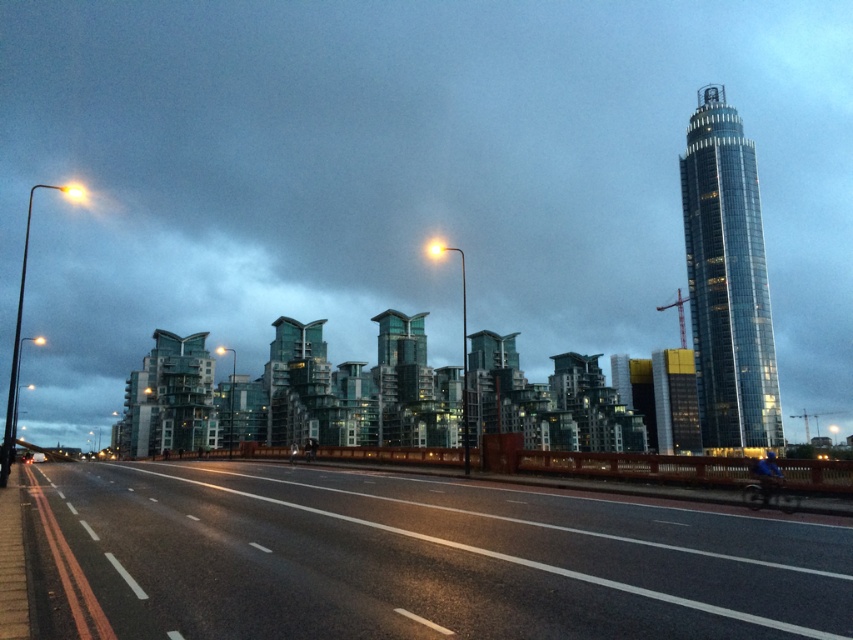
Does black asphalt highway at lower left have a lesser height compared to shiny glass tower at upper right?

Yes, black asphalt highway at lower left is shorter than shiny glass tower at upper right.

Is point (519, 545) more distant than point (682, 184)?

No, (519, 545) is in front of (682, 184).

This screenshot has height=640, width=853. Identify the location of black asphalt highway at lower left. (432, 560).